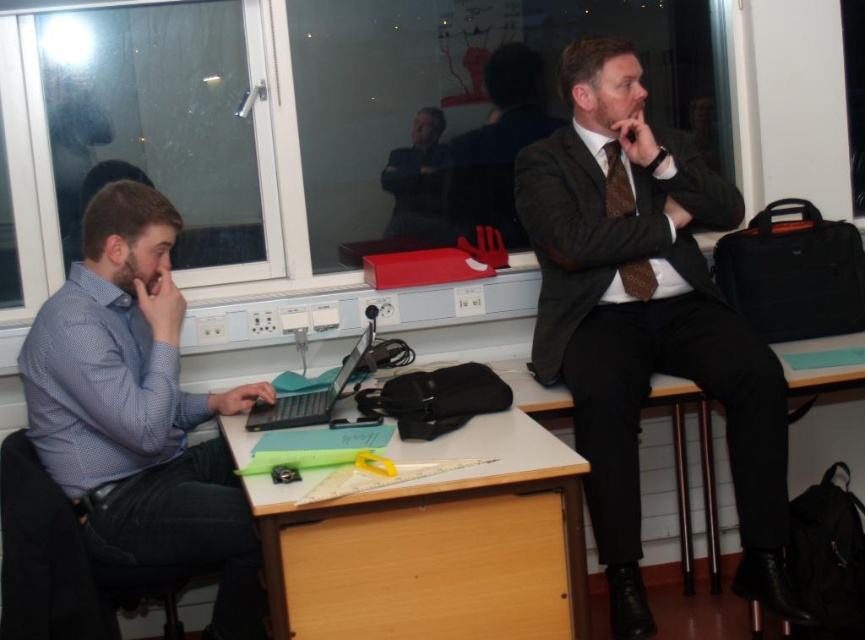
Question: Estimate the real-world distances between objects in this image. Which object is farther from the dark gray suit at center?

Choices:
 (A) wooden at center
 (B) blue dotted shirt at left
 (C) teal plastic laptop at center
 (D) dark gray wool suit at right

Answer: (A)

Question: Which of the following is the closest to the observer?

Choices:
 (A) dark gray wool suit at right
 (B) dark gray suit at center

Answer: (A)

Question: Does blue dotted shirt at left appear on the left side of wooden at center?

Choices:
 (A) yes
 (B) no

Answer: (A)

Question: Is blue dotted shirt at left positioned behind dark gray suit at center?

Choices:
 (A) yes
 (B) no

Answer: (B)

Question: Which object is positioned closest to the blue dotted shirt at left?

Choices:
 (A) wooden at center
 (B) teal plastic laptop at center

Answer: (B)

Question: Is wooden at center further to the viewer compared to teal plastic laptop at center?

Choices:
 (A) yes
 (B) no

Answer: (B)